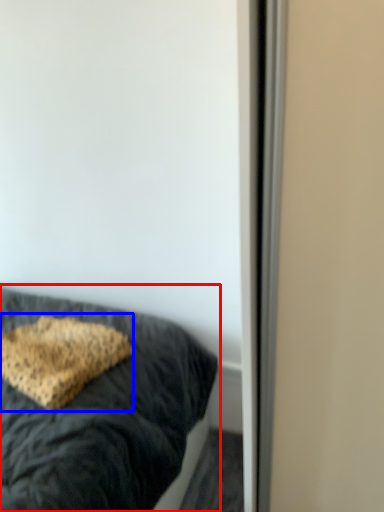
Question: Which point is further to the camera, bed (highlighted by a red box) or pillow (highlighted by a blue box)?

Choices:
 (A) bed
 (B) pillow

Answer: (B)